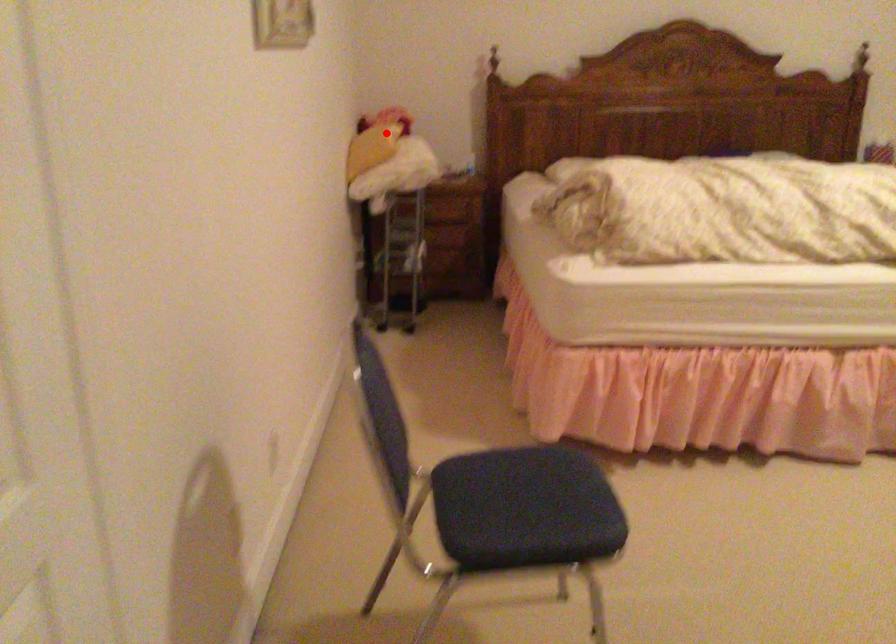
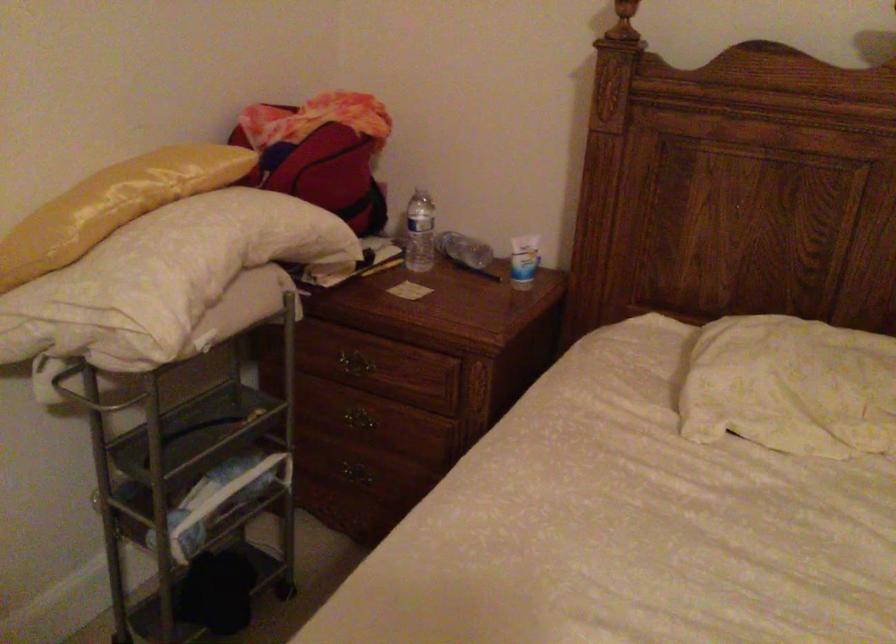
Locate, in the second image, the point that corresponds to the highlighted location in the first image.

(113, 205)